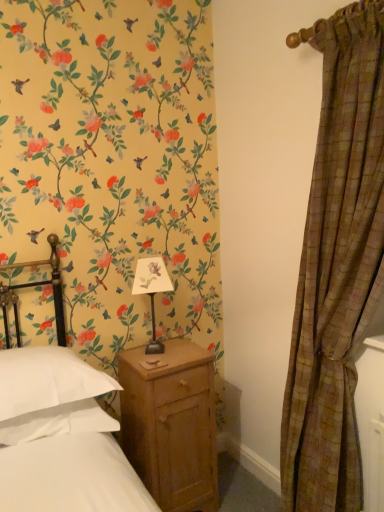
Measure the distance between point (137, 349) and camera.

They are 6.98 feet apart.

Measure the distance between wooden nightstand at lower center and camera.

They are 1.82 meters apart.

At what (x,y) coordinates should I click in order to perform the action: click on matte black table lamp at center. Please return your answer as a coordinate pair (x, y). Image resolution: width=384 pixels, height=512 pixels. Looking at the image, I should click on (152, 291).

Describe the element at coordinates (152, 291) in the screenshot. I see `matte black table lamp at center` at that location.

In order to face white soft pillow at lower left, should I rotate leftwards or rightwards?

Turn left approximately 18.760 degrees to face it.

What do you see at coordinates (336, 266) in the screenshot?
I see `brown plaid curtain at right` at bounding box center [336, 266].

You are a GUI agent. You are given a task and a screenshot of the screen. Output one action in this format:
    pyautogui.click(x=<x>, y=<y>)
    Task: Click on the wooden nightstand at lower center
    This screenshot has height=512, width=384.
    Given the screenshot: What is the action you would take?
    pyautogui.click(x=171, y=424)

Which object is further away from the camera, wooden nightstand at lower center or matte black table lamp at center?

matte black table lamp at center is further away from the camera.

Which object is positioned more to the left, wooden nightstand at lower center or matte black table lamp at center?

matte black table lamp at center.

Which of these two, wooden nightstand at lower center or matte black table lamp at center, stands taller?

Standing taller between the two is wooden nightstand at lower center.

Is wooden nightstand at lower center placed right next to matte black table lamp at center?

No.

Who is bigger, matte black table lamp at center or brown plaid curtain at right?

brown plaid curtain at right.

Does matte black table lamp at center come in front of brown plaid curtain at right?

No.

Which is behind, point (145, 263) or point (363, 278)?

The point (145, 263) is farther.

Is matte black table lamp at center taller or shorter than brown plaid curtain at right?

Clearly, matte black table lamp at center is shorter compared to brown plaid curtain at right.

Is wooden nightstand at lower center at the right side of white soft pillow at lower left?

Indeed, wooden nightstand at lower center is positioned on the right side of white soft pillow at lower left.

Locate an element on the screen. The width and height of the screenshot is (384, 512). pillow located on the left of wooden nightstand at lower center is located at coordinates (47, 380).

Measure the distance from wooden nightstand at lower center to white soft pillow at lower left.

wooden nightstand at lower center is 17.44 inches away from white soft pillow at lower left.

Which object is thinner, wooden nightstand at lower center or white soft pillow at lower left?

wooden nightstand at lower center.

From a real-world perspective, which is physically below, brown plaid curtain at right or white soft pillow at lower left?

→ From a 3D spatial view, white soft pillow at lower left is below.

Find the location of a particular element. Image resolution: width=384 pixels, height=512 pixels. pillow that is behind the brown plaid curtain at right is located at coordinates (47, 380).

Consider the image. Measure the distance between brown plaid curtain at right and white soft pillow at lower left.

A distance of 98.25 centimeters exists between brown plaid curtain at right and white soft pillow at lower left.

Visually, is brown plaid curtain at right positioned to the left or to the right of white soft pillow at lower left?

Clearly, brown plaid curtain at right is on the right of white soft pillow at lower left in the image.

From the image's perspective, is wooden nightstand at lower center located beneath brown plaid curtain at right?

Indeed, from the image's perspective, wooden nightstand at lower center is shown beneath brown plaid curtain at right.

Does wooden nightstand at lower center have a smaller size compared to brown plaid curtain at right?

Indeed, wooden nightstand at lower center has a smaller size compared to brown plaid curtain at right.

Would you say brown plaid curtain at right is part of wooden nightstand at lower center's contents?

No, brown plaid curtain at right is located outside of wooden nightstand at lower center.

Does wooden nightstand at lower center have a lesser width compared to brown plaid curtain at right?

In fact, wooden nightstand at lower center might be wider than brown plaid curtain at right.

Is matte black table lamp at center located within brown plaid curtain at right?

No, matte black table lamp at center is not a part of brown plaid curtain at right.

Could you tell me if brown plaid curtain at right is turned towards matte black table lamp at center?

No, brown plaid curtain at right is not oriented towards matte black table lamp at center.

Would you say brown plaid curtain at right is to the left or to the right of matte black table lamp at center in the picture?

From the image, it's evident that brown plaid curtain at right is to the right of matte black table lamp at center.

Can we say matte black table lamp at center lies outside wooden nightstand at lower center?

Yes, matte black table lamp at center is located beyond the bounds of wooden nightstand at lower center.

Can you tell me how much matte black table lamp at center and wooden nightstand at lower center differ in facing direction?

The facing directions of matte black table lamp at center and wooden nightstand at lower center are 29.3 degrees apart.

Is matte black table lamp at center at the left side of wooden nightstand at lower center?

Correct, you'll find matte black table lamp at center to the left of wooden nightstand at lower center.

Relative to wooden nightstand at lower center, is matte black table lamp at center in front or behind?

matte black table lamp at center is behind wooden nightstand at lower center.

Find the location of a particular element. This screenshot has width=384, height=512. table lamp behind the wooden nightstand at lower center is located at coordinates (152, 291).

In order to click on table lamp that is below the brown plaid curtain at right (from the image's perspective) in this screenshot , I will do `click(152, 291)`.

Looking at the image, which one is located further to matte black table lamp at center, white soft pillow at lower left or brown plaid curtain at right?

Among the two, brown plaid curtain at right is located further to matte black table lamp at center.

Looking at the image, which one is located further to wooden nightstand at lower center, matte black table lamp at center or brown plaid curtain at right?

Based on the image, brown plaid curtain at right appears to be further to wooden nightstand at lower center.

Based on the photo, looking at the image, which one is located closer to white soft pillow at lower left, wooden nightstand at lower center or matte black table lamp at center?

Based on the image, wooden nightstand at lower center appears to be nearer to white soft pillow at lower left.

Considering their positions, is wooden nightstand at lower center positioned further to matte black table lamp at center than brown plaid curtain at right?

brown plaid curtain at right lies further to matte black table lamp at center than the other object.

When comparing their distances from wooden nightstand at lower center, does white soft pillow at lower left or brown plaid curtain at right seem closer?

white soft pillow at lower left is closer to wooden nightstand at lower center.

From the picture: When comparing their distances from matte black table lamp at center, does brown plaid curtain at right or white soft pillow at lower left seem closer?

white soft pillow at lower left is positioned closer to the anchor matte black table lamp at center.

Considering their positions, is white soft pillow at lower left positioned closer to wooden nightstand at lower center than matte black table lamp at center?

matte black table lamp at center.

From the image, which object appears to be nearer to white soft pillow at lower left, wooden nightstand at lower center or brown plaid curtain at right?

wooden nightstand at lower center.

Where is `nightstand positioned between brown plaid curtain at right and matte black table lamp at center from near to far`? The width and height of the screenshot is (384, 512). nightstand positioned between brown plaid curtain at right and matte black table lamp at center from near to far is located at coordinates (171, 424).

At what (x,y) coordinates should I click in order to perform the action: click on pillow between matte black table lamp at center and wooden nightstand at lower center from top to bottom. Please return your answer as a coordinate pair (x, y). Looking at the image, I should click on (47, 380).

The width and height of the screenshot is (384, 512). In order to click on table lamp situated between white soft pillow at lower left and brown plaid curtain at right from left to right in this screenshot , I will do pyautogui.click(x=152, y=291).

The image size is (384, 512). I want to click on nightstand between white soft pillow at lower left and brown plaid curtain at right from left to right, so click(171, 424).